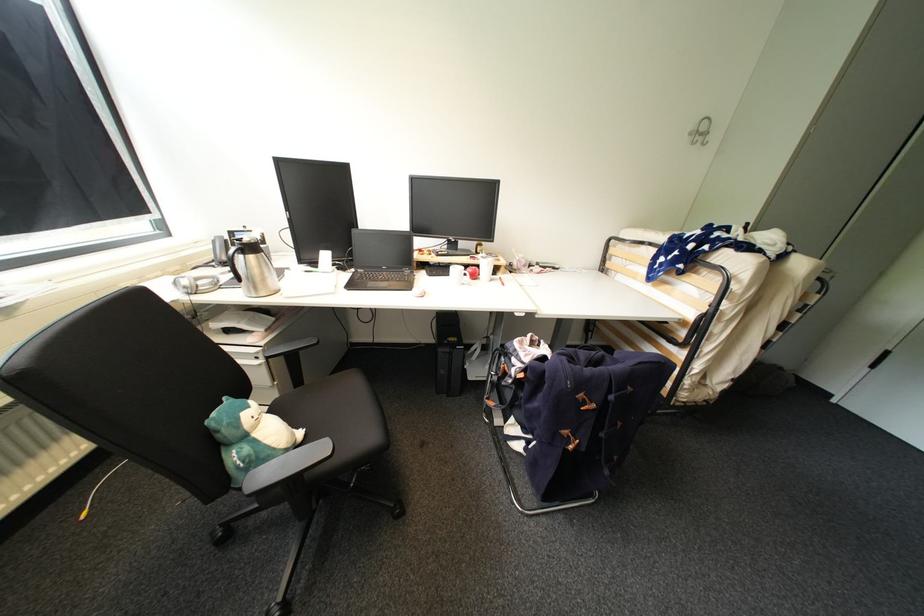
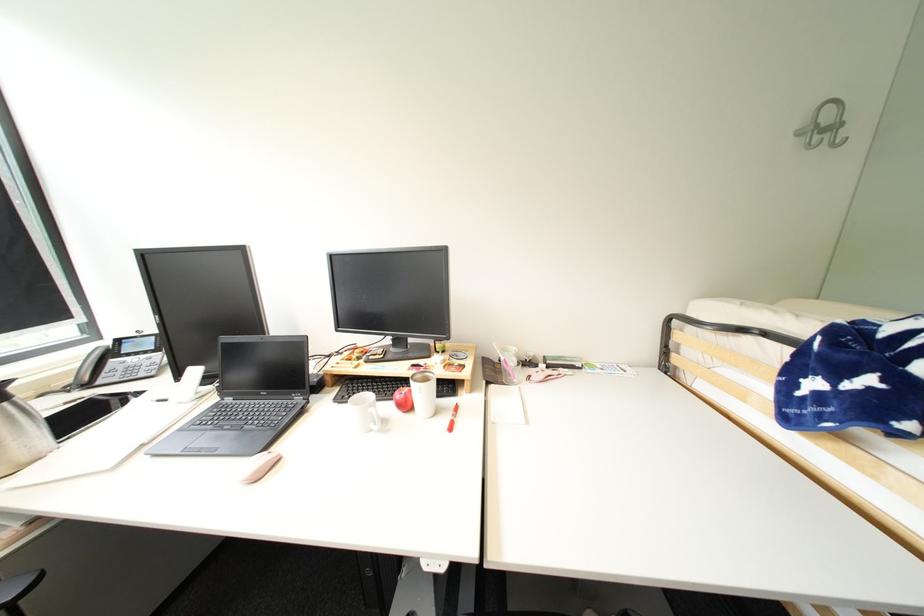
Where in the second image is the point corresponding to pixel 477 270 from the first image?

(405, 397)